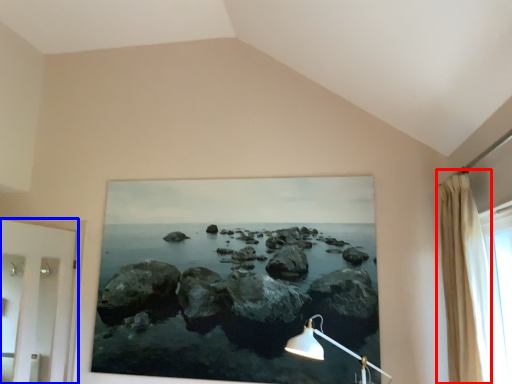
Question: Which of the following is the farthest to the observer, curtain (highlighted by a red box) or door (highlighted by a blue box)?

Choices:
 (A) curtain
 (B) door

Answer: (B)